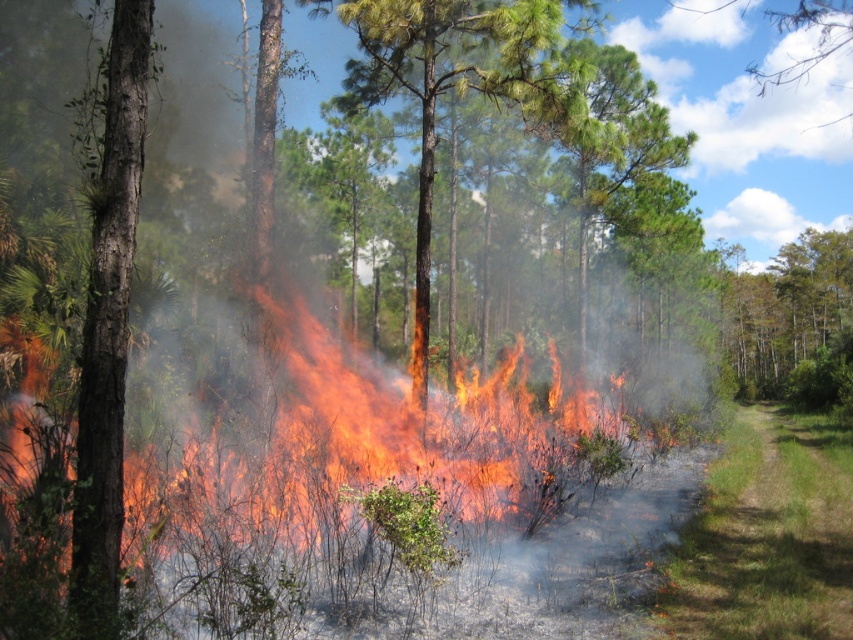
Which is behind, point (103, 108) or point (839, 339)?

Point (839, 339)

The width and height of the screenshot is (853, 640). I want to click on smooth bark tree at left, so click(x=108, y=330).

Identify the location of smooth bark tree at left. The width and height of the screenshot is (853, 640). (108, 330).